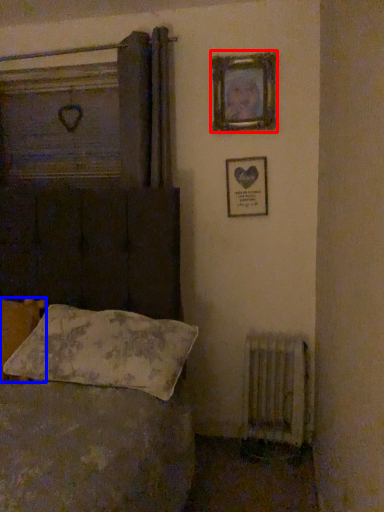
Question: Which point is closer to the camera, picture frame (highlighted by a red box) or pillow (highlighted by a blue box)?

Choices:
 (A) picture frame
 (B) pillow

Answer: (B)